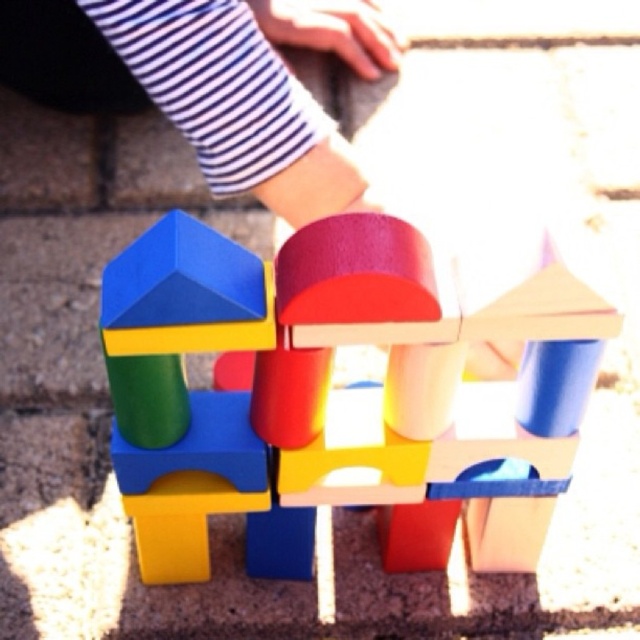
Which is more to the left, wooden blocks at center or striped fabric at upper center?

From the viewer's perspective, striped fabric at upper center appears more on the left side.

Which is behind, point (195, 260) or point (237, 140)?

The point (237, 140) is behind.

Between point (344, 339) and point (211, 116), which one is positioned in front?

Point (344, 339) is in front.

Locate an element on the screen. The width and height of the screenshot is (640, 640). wooden blocks at center is located at coordinates (342, 390).